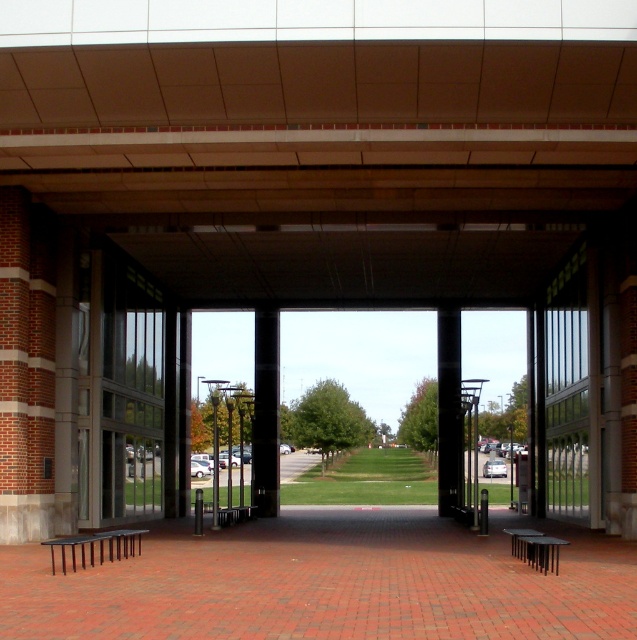
Question: Observing the image, what is the correct spatial positioning of black glossy column at center in reference to black smooth pillar at center?

Choices:
 (A) right
 (B) left

Answer: (B)

Question: Is black glossy column at center positioned in front of black smooth pillar at center?

Choices:
 (A) no
 (B) yes

Answer: (A)

Question: Can you confirm if black glossy column at center is positioned to the left of black smooth pillar at center?

Choices:
 (A) no
 (B) yes

Answer: (B)